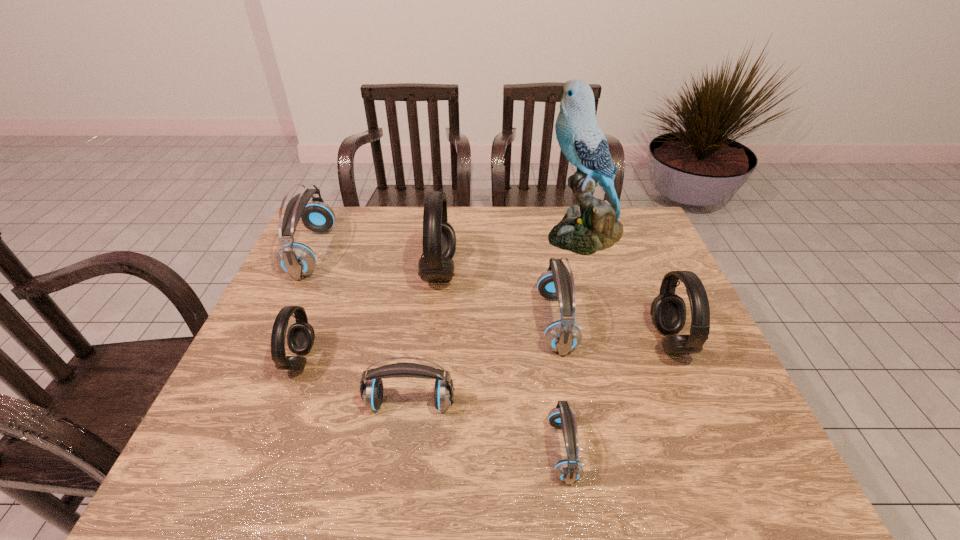
Identify the location of vacant region that satisfies the following two spatial constraints: 1. on the ear cups of the second farthest blue headset; 2. on the ear cups of the third biggest blue headset. The height and width of the screenshot is (540, 960). (570, 403).

Identify the location of free point that satisfies the following two spatial constraints: 1. on the earcups of the tallest headset; 2. on the ear cups of the second smallest blue headset. tap(425, 403).